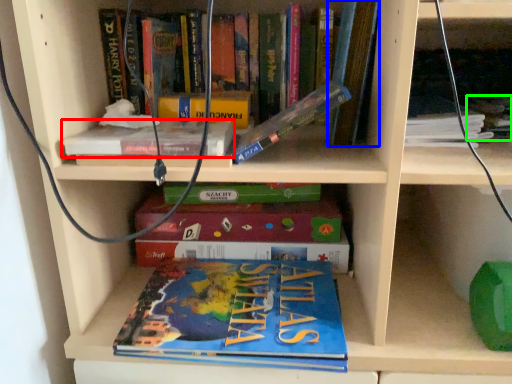
Question: Which is nearer to the book (highlighted by a red box)? book (highlighted by a blue box) or book (highlighted by a green box).

Choices:
 (A) book
 (B) book

Answer: (A)